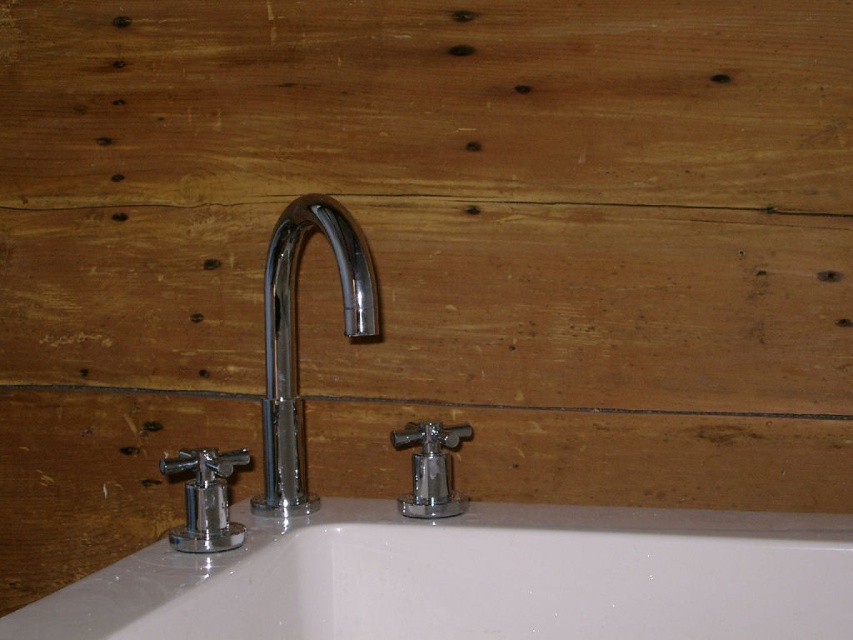
Is white glossy bath at center to the left of chrome/metallic faucet at center from the viewer's perspective?

Incorrect, white glossy bath at center is not on the left side of chrome/metallic faucet at center.

Who is more distant from viewer, (57, 604) or (271, 433)?

Positioned behind is point (271, 433).

Does point (136, 572) come behind point (352, 285)?

Yes, it is behind point (352, 285).

At what (x,y) coordinates should I click in order to perform the action: click on white glossy bath at center. Please return your answer as a coordinate pair (x, y). This screenshot has width=853, height=640. Looking at the image, I should click on (474, 579).